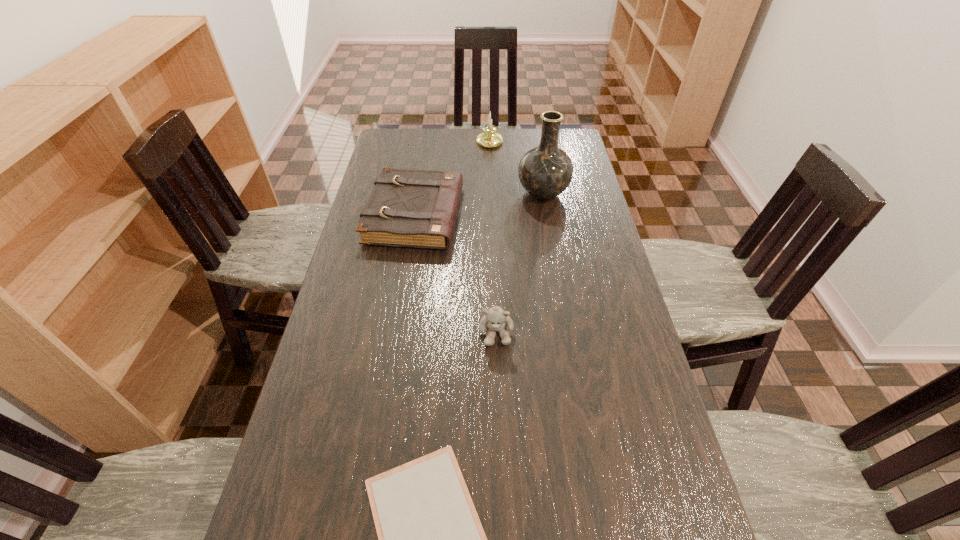
Identify the location of the rightmost object. Image resolution: width=960 pixels, height=540 pixels. (545, 171).

Locate an element on the screen. This screenshot has height=540, width=960. vase is located at coordinates (545, 171).

The width and height of the screenshot is (960, 540). What are the coordinates of `the farthest object` in the screenshot? It's located at (489, 138).

Image resolution: width=960 pixels, height=540 pixels. Identify the location of the fourth shortest object. (489, 138).

Find the location of a particular element. The image size is (960, 540). the fourth farthest object is located at coordinates (496, 319).

I want to click on teddy bear, so click(x=496, y=319).

This screenshot has width=960, height=540. In order to click on the fourth tallest object in this screenshot , I will do `click(407, 208)`.

Where is `free space located on the left of the tallest object`? Image resolution: width=960 pixels, height=540 pixels. free space located on the left of the tallest object is located at coordinates (x=503, y=193).

I want to click on free location located 0.300m on the handle side of the farthest object, so (492, 196).

The height and width of the screenshot is (540, 960). What are the coordinates of `free point located on the face of the third tallest object` in the screenshot? It's located at (499, 423).